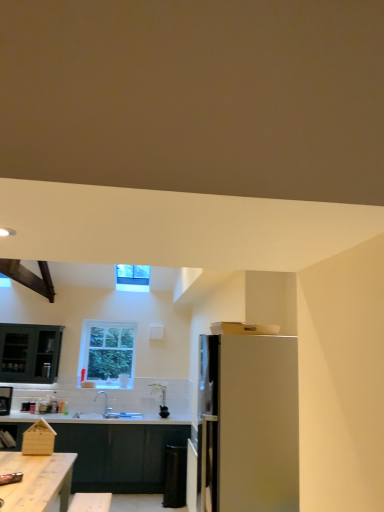
At what (x,y) coordinates should I click in order to perform the action: click on free space above wooden table at lower left (from a real-world perspective). Please return your answer as a coordinate pair (x, y). This screenshot has width=384, height=512. Looking at the image, I should click on click(25, 474).